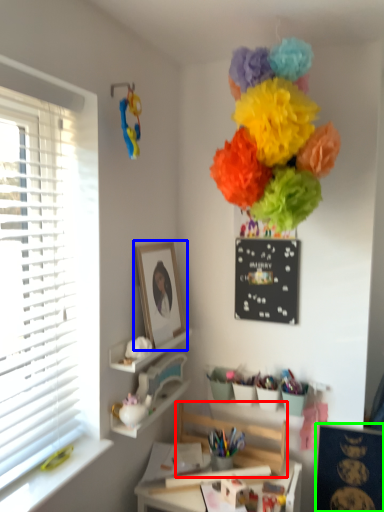
Question: Considering the real-world distances, which object is closest to swivel chair (highlighted by a red box)? picture frame (highlighted by a blue box) or bulletin board (highlighted by a green box).

Choices:
 (A) picture frame
 (B) bulletin board

Answer: (B)